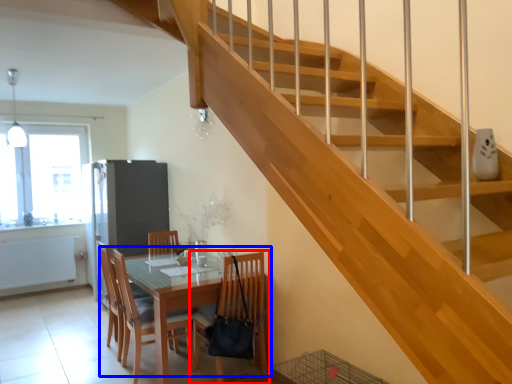
Question: Which object appears farthest to the camera in this image, chair (highlighted by a red box) or kitchen & dining room table (highlighted by a blue box)?

Choices:
 (A) chair
 (B) kitchen & dining room table

Answer: (A)